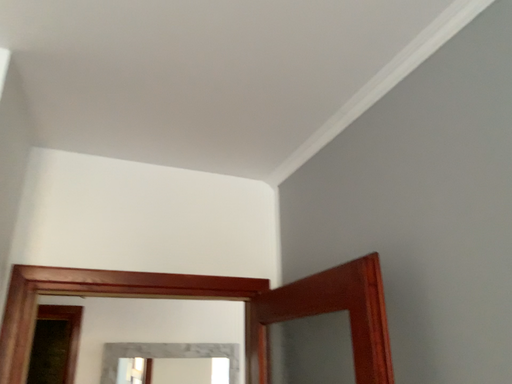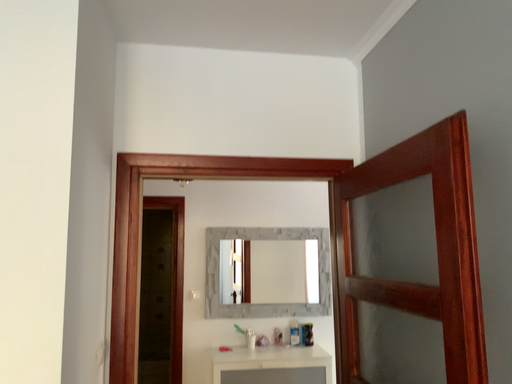
Question: How did the camera likely rotate when shooting the video?

Choices:
 (A) rotated downward
 (B) rotated upward

Answer: (A)